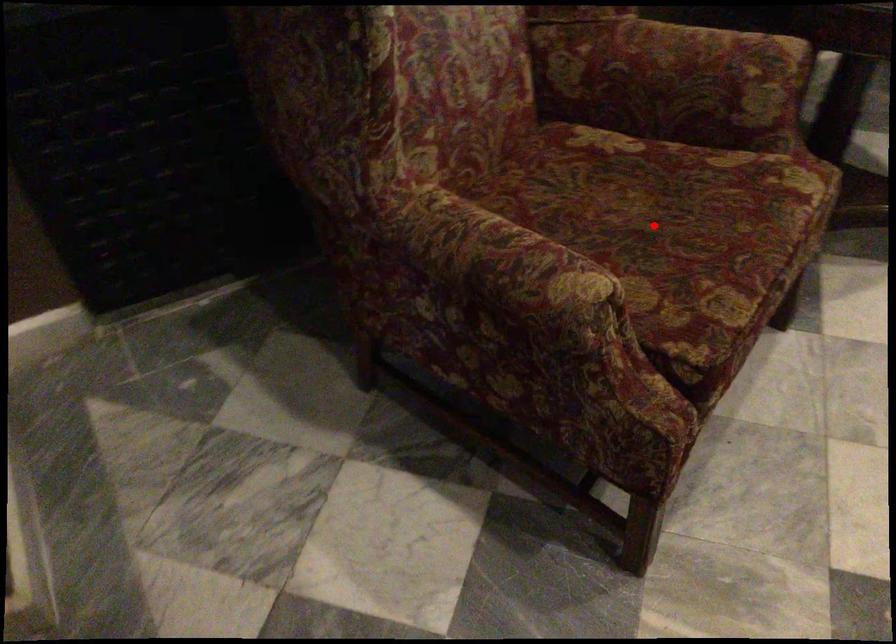
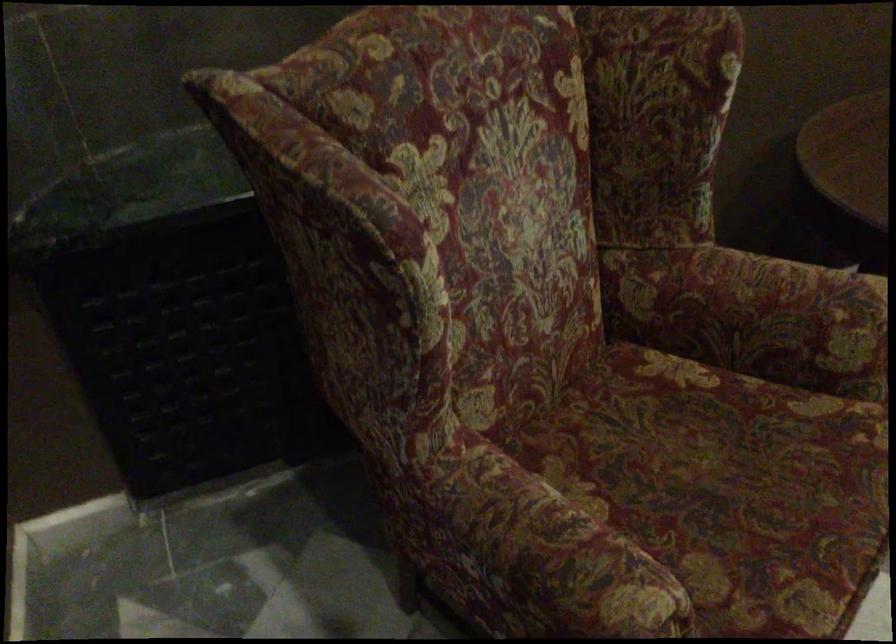
Question: A red point is marked in image1. In image2, is the corresponding 3D point closer to the camera or farther? Reply with the corresponding letter.

Choices:
 (A) The corresponding 3D point is closer.
 (B) The corresponding 3D point is farther.

Answer: (A)